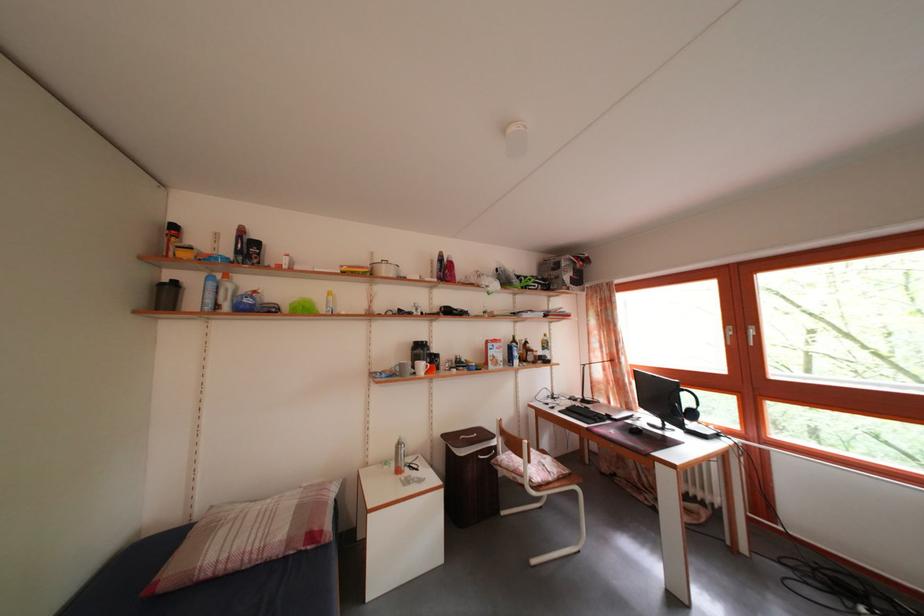
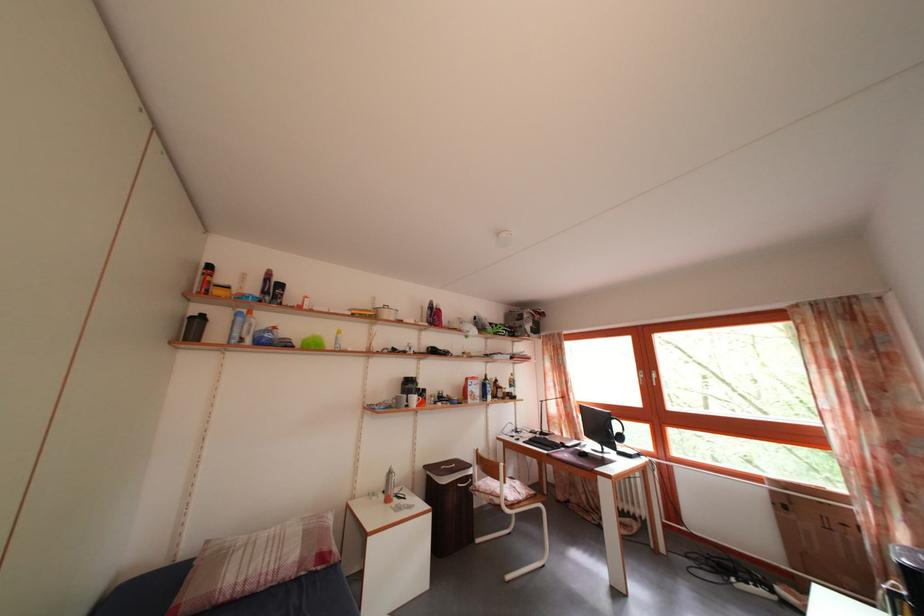
Locate, in the second image, the point that corresponds to (743,339) in the first image.

(652, 382)